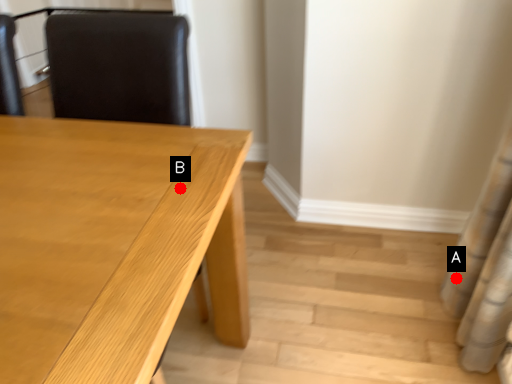
Question: Two points are circled on the image, labeled by A and B beside each circle. Which of the following is the farthest from the observer?

Choices:
 (A) A is further
 (B) B is further

Answer: (A)